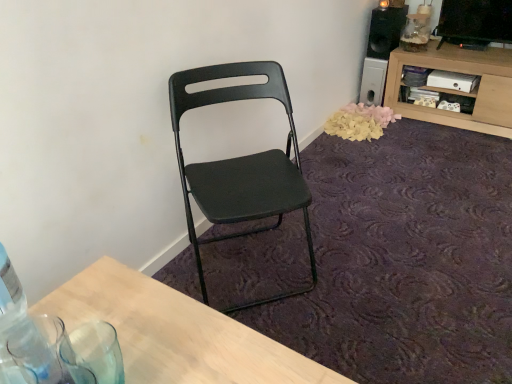
Question: Can you confirm if matte black folding chair at center is wider than wooden cabinet at upper right?

Choices:
 (A) yes
 (B) no

Answer: (B)

Question: From a real-world perspective, is matte black folding chair at center located beneath wooden cabinet at upper right?

Choices:
 (A) no
 (B) yes

Answer: (A)

Question: Is there a large distance between matte black folding chair at center and wooden cabinet at upper right?

Choices:
 (A) no
 (B) yes

Answer: (B)

Question: Is matte black folding chair at center facing away from wooden cabinet at upper right?

Choices:
 (A) no
 (B) yes

Answer: (A)

Question: Is matte black folding chair at center closer to the viewer compared to wooden cabinet at upper right?

Choices:
 (A) no
 (B) yes

Answer: (B)

Question: From the image's perspective, is wooden cabinet at upper right located above or below black matte speaker at upper right?

Choices:
 (A) above
 (B) below

Answer: (B)

Question: Considering the relative positions of wooden cabinet at upper right and black matte speaker at upper right in the image provided, is wooden cabinet at upper right to the left or to the right of black matte speaker at upper right?

Choices:
 (A) left
 (B) right

Answer: (B)

Question: In terms of width, does wooden cabinet at upper right look wider or thinner when compared to black matte speaker at upper right?

Choices:
 (A) thin
 (B) wide

Answer: (B)

Question: Is wooden cabinet at upper right situated inside black matte speaker at upper right or outside?

Choices:
 (A) outside
 (B) inside

Answer: (A)

Question: Is clear glass bottle at lower left wider or thinner than matte black folding chair at center?

Choices:
 (A) wide
 (B) thin

Answer: (B)

Question: Considering the positions of clear glass bottle at lower left and matte black folding chair at center in the image, is clear glass bottle at lower left bigger or smaller than matte black folding chair at center?

Choices:
 (A) big
 (B) small

Answer: (B)

Question: From the image's perspective, is clear glass bottle at lower left above or below matte black folding chair at center?

Choices:
 (A) below
 (B) above

Answer: (A)

Question: Relative to matte black folding chair at center, is clear glass bottle at lower left in front or behind?

Choices:
 (A) behind
 (B) front

Answer: (B)

Question: Looking at the image, does yellow paper petals at lower right seem bigger or smaller compared to wooden cabinet at upper right?

Choices:
 (A) small
 (B) big

Answer: (A)

Question: Considering the relative positions of yellow paper petals at lower right and wooden cabinet at upper right in the image provided, is yellow paper petals at lower right to the left or to the right of wooden cabinet at upper right?

Choices:
 (A) right
 (B) left

Answer: (B)